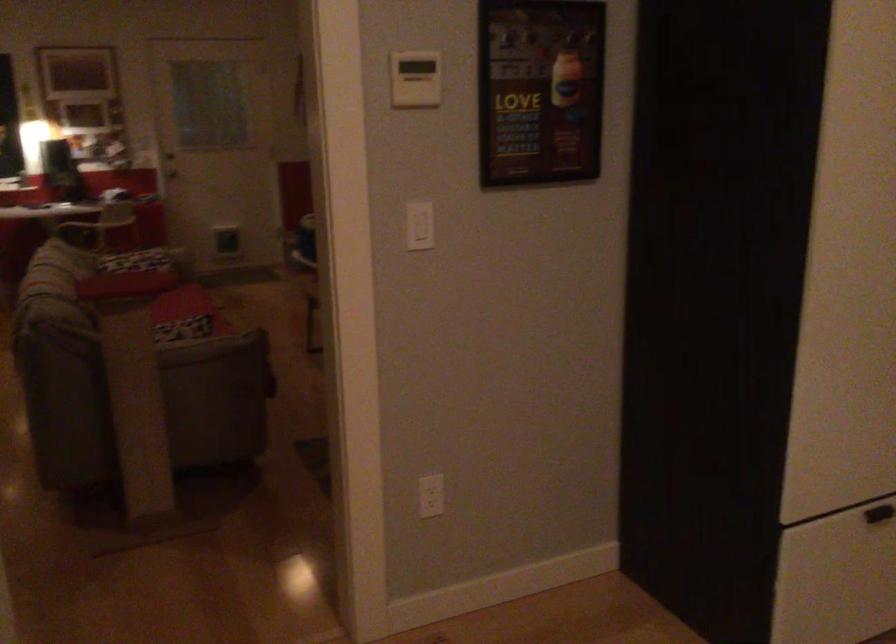
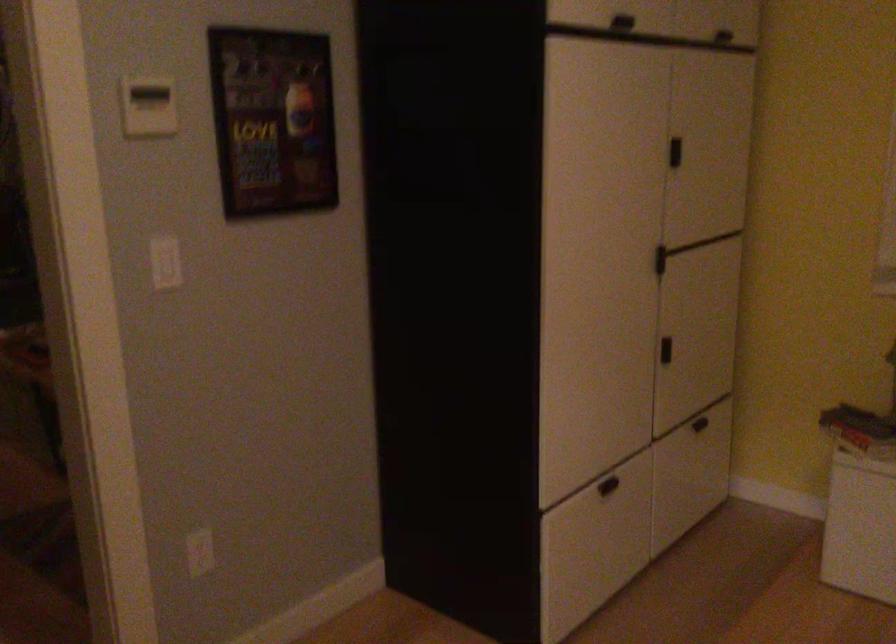
Question: What movement of the cameraman would produce the second image?

Choices:
 (A) Left
 (B) Right
 (C) Forward
 (D) Backward

Answer: (A)